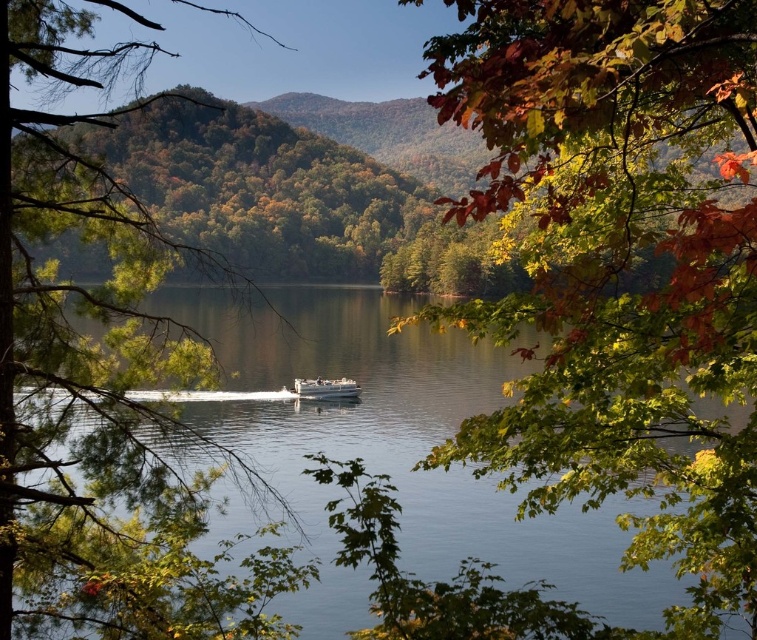
Can you confirm if green matte tree at center is bigger than clear blue water at center?

Correct, green matte tree at center is larger in size than clear blue water at center.

Find the location of a particular element. Image resolution: width=757 pixels, height=640 pixels. green matte tree at center is located at coordinates (98, 384).

Does point (83, 305) lie behind point (346, 440)?

No.

Where is `green matte tree at center`? Image resolution: width=757 pixels, height=640 pixels. green matte tree at center is located at coordinates (98, 384).

In order to click on clear blue water at center in this screenshot , I will do `click(341, 371)`.

Between clear blue water at center and white plastic boat at center, which one has less height?

Standing shorter between the two is white plastic boat at center.

Is point (192, 416) closer to camera compared to point (326, 397)?

That is True.

The width and height of the screenshot is (757, 640). What are the coordinates of `clear blue water at center` in the screenshot? It's located at (341, 371).

Does autumn leaves at upper right come behind white plastic boat at center?

No, autumn leaves at upper right is in front of white plastic boat at center.

Measure the distance between autumn leaves at upper right and white plastic boat at center.

79.62 feet

Find the location of `autumn leaves at upper right`. autumn leaves at upper right is located at coordinates (621, 264).

This screenshot has width=757, height=640. Find the location of `autumn leaves at upper right`. autumn leaves at upper right is located at coordinates (621, 264).